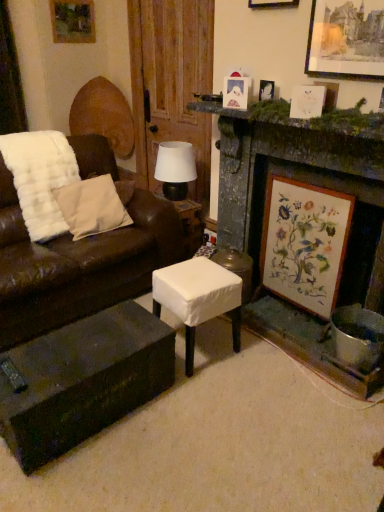
Question: Is point (246, 259) positioned closer to the camera than point (307, 103)?

Choices:
 (A) farther
 (B) closer

Answer: (A)

Question: Considering the positions of white fabric stool at center and white paper picture frame at upper right, which is counted as the fifth picture frame, starting from the back, in the image, is white fabric stool at center taller or shorter than white paper picture frame at upper right, which is counted as the fifth picture frame, starting from the back,?

Choices:
 (A) tall
 (B) short

Answer: (A)

Question: Estimate the real-world distances between objects in this image. Which object is farther from the matte black table lamp at center?

Choices:
 (A) beige cotton pillow at left
 (B) white paper picture frame at upper center, which is the fifth picture frame from front to back
 (C) wooden framed botanical print at right, which is the 6th picture frame from top to bottom
 (D) stone fireplace at center right
 (E) wooden picture frame at upper right, the 3th picture frame from the top

Answer: (E)

Question: Which object is the farthest from the matte black table lamp at center?

Choices:
 (A) stone fireplace at center right
 (B) beige cotton pillow at left
 (C) white fabric-covered stool at center
 (D) wooden picture frame at upper right, arranged as the 1th picture frame when viewed from the right
 (E) wooden picture frame at upper center, marked as the 4th picture frame in a right-to-left arrangement

Answer: (D)